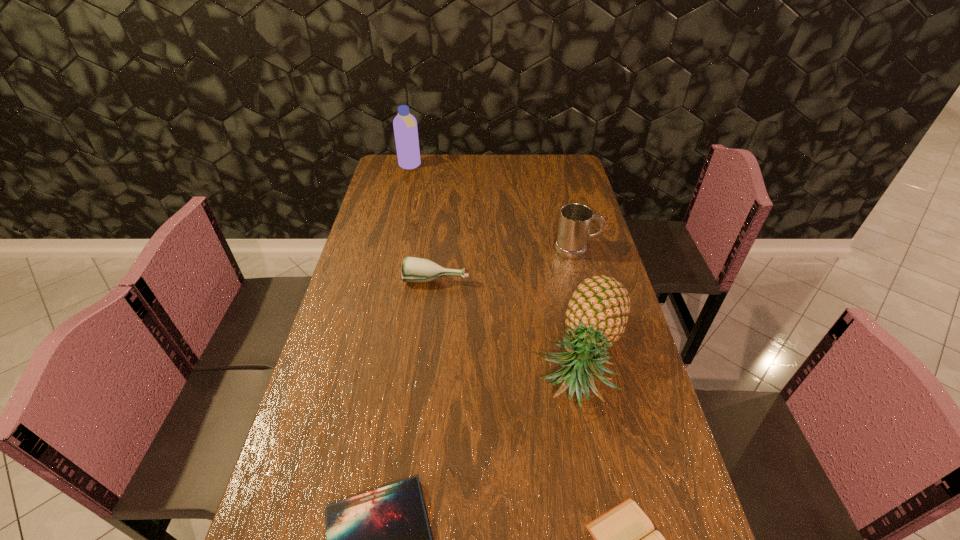
Where is `free space located on the front of the third farthest object`? This screenshot has width=960, height=540. free space located on the front of the third farthest object is located at coordinates (428, 362).

What are the coordinates of `object that is at the far edge` in the screenshot? It's located at (405, 125).

Identify the location of object at the left edge. (405, 125).

I want to click on pineapple at the right edge, so click(597, 313).

Where is `mug located at the right edge`? mug located at the right edge is located at coordinates (575, 219).

Where is `object at the far left corner`? object at the far left corner is located at coordinates (405, 125).

The width and height of the screenshot is (960, 540). In order to click on vacant position at the far edge of the desktop in this screenshot , I will do `click(471, 170)`.

This screenshot has height=540, width=960. Identify the location of vacant space at the left edge of the desktop. (331, 388).

In the image, there is a desktop. At what (x,y) coordinates should I click in order to perform the action: click on vacant space at the right edge. Please return your answer as a coordinate pair (x, y). The image size is (960, 540). Looking at the image, I should click on (550, 203).

Where is `vacant space at the far right corner of the desktop`? vacant space at the far right corner of the desktop is located at coordinates (548, 176).